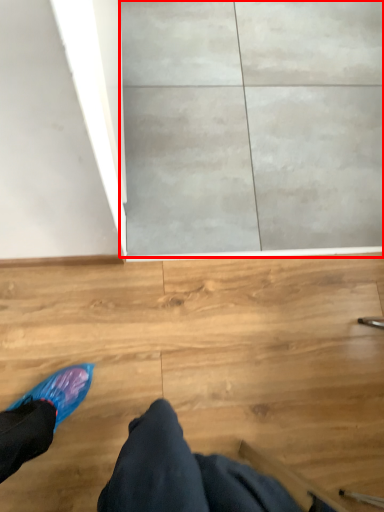
Question: From the image's perspective, what is the correct spatial relationship of concrete (annotated by the red box) in relation to person?

Choices:
 (A) above
 (B) below

Answer: (A)